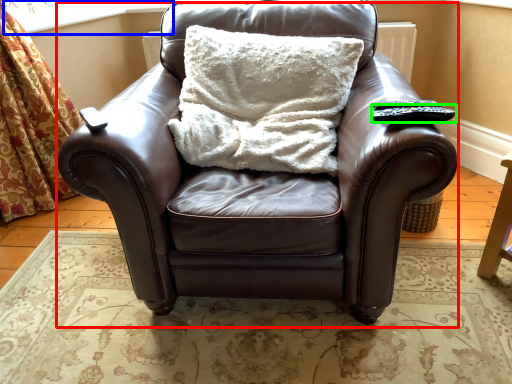
Question: Which object is positioned closest to chair (highlighted by a red box)? Select from window screen (highlighted by a blue box) and remote (highlighted by a green box).

Choices:
 (A) window screen
 (B) remote

Answer: (B)